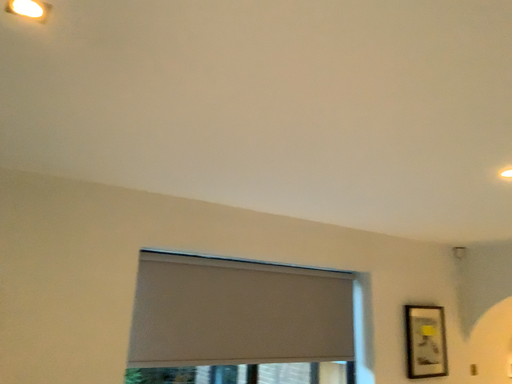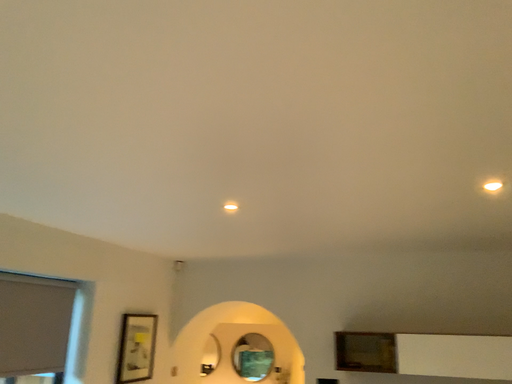
Question: Which way did the camera rotate in the video?

Choices:
 (A) rotated right
 (B) rotated left

Answer: (A)